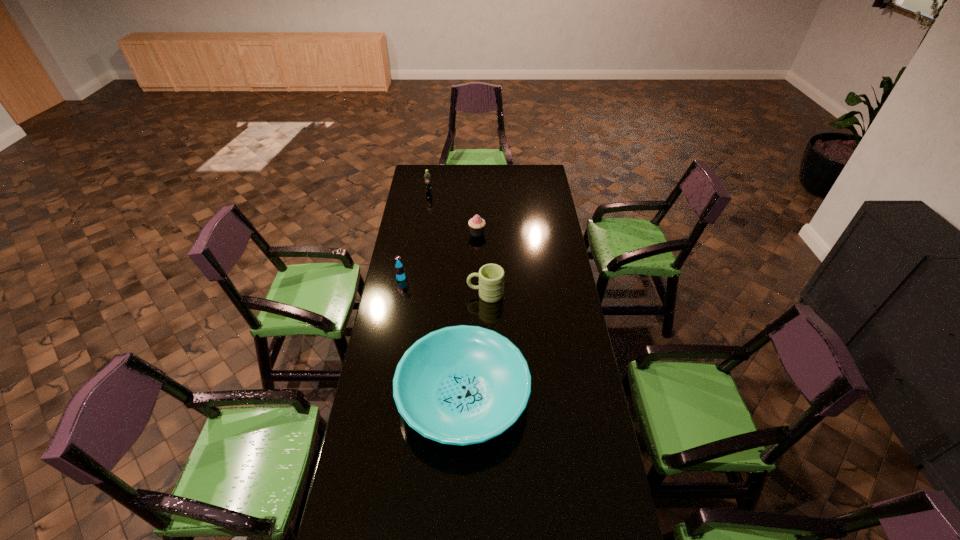
Image resolution: width=960 pixels, height=540 pixels. What are the coordinates of `vacant space that satisfies the following two spatial constraints: 1. on the front label of the farthest object; 2. on the right side of the dish` in the screenshot? It's located at (398, 395).